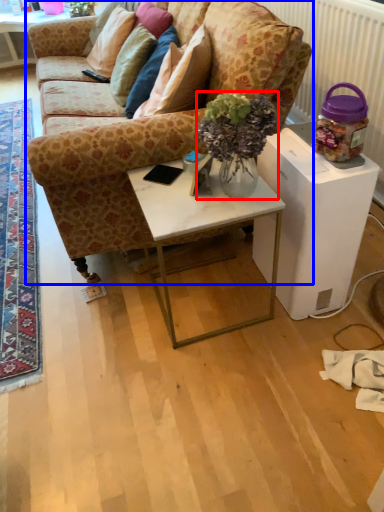
Question: Which object appears closest to the camera in this image, houseplant (highlighted by a red box) or studio couch (highlighted by a blue box)?

Choices:
 (A) houseplant
 (B) studio couch

Answer: (A)